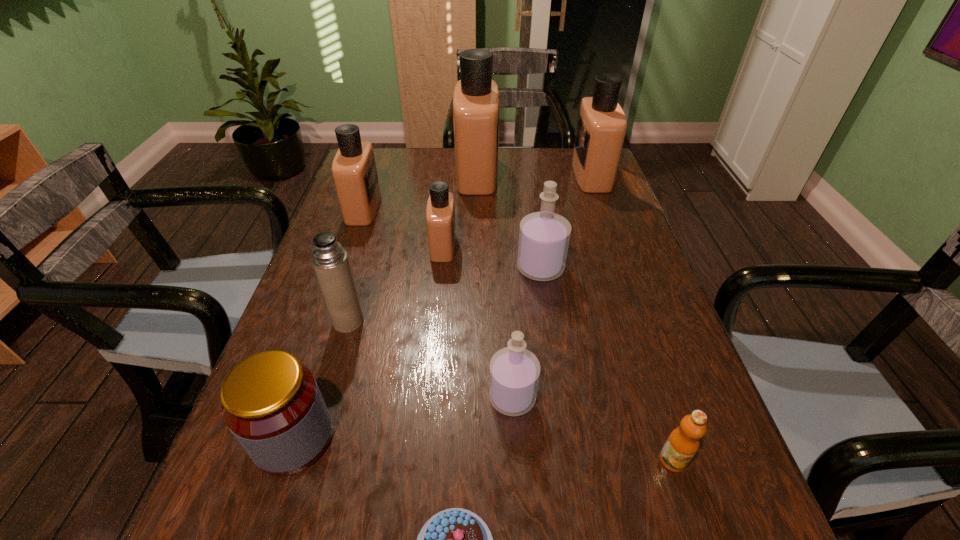
Find the location of a particular element. This screenshot has height=540, width=960. the nearest perfume is located at coordinates (514, 372).

Find the location of a particular element. jar is located at coordinates (271, 403).

Identify the location of the second shortest object. (683, 442).

Locate an element on the screen. vacant space located 0.200m on the front label of the biggest beige perfume is located at coordinates (560, 173).

What are the coordinates of `blank area located 0.270m on the front label of the fifth shortest perfume` in the screenshot? It's located at (490, 175).

Locate an element on the screen. This screenshot has width=960, height=540. free space located 0.200m on the front label of the fifth shortest perfume is located at coordinates (512, 175).

At what (x,y) coordinates should I click in order to perform the action: click on blank area located on the front label of the fifth shortest perfume. Please return your answer as a coordinate pair (x, y). This screenshot has width=960, height=540. Looking at the image, I should click on (555, 175).

Image resolution: width=960 pixels, height=540 pixels. I want to click on free space located 0.060m on the front of the bigger purple perfume, so click(545, 303).

The width and height of the screenshot is (960, 540). In order to click on vacant point located 0.330m on the front label of the leftmost beige perfume in this screenshot , I will do `click(493, 208)`.

Locate an element on the screen. This screenshot has width=960, height=540. vacant space located 0.280m on the front of the thermos bottle is located at coordinates (307, 464).